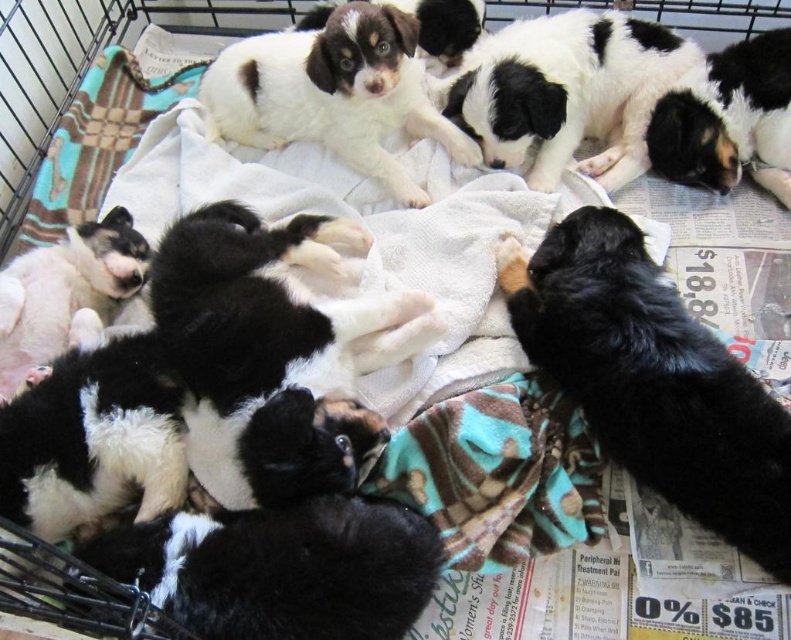
Question: Which of the following is the closest to the observer?

Choices:
 (A) (723, 454)
 (B) (55, 276)
 (C) (385, 80)
 (D) (313, 243)

Answer: (A)

Question: Does black soft fur at center appear under white fur at left?

Choices:
 (A) yes
 (B) no

Answer: (A)

Question: Among these points, which one is farthest from the camera?

Choices:
 (A) click(642, 445)
 (B) click(19, 305)
 (C) click(279, 38)

Answer: (C)

Question: Does black and white fur at upper center come behind white fur at left?

Choices:
 (A) no
 (B) yes

Answer: (B)

Question: Is black soft fur at center above white soft fur puppy at upper center?

Choices:
 (A) yes
 (B) no

Answer: (B)

Question: Which point is farther from the camera taking this photo?

Choices:
 (A) [x=31, y=305]
 (B) [x=214, y=211]

Answer: (B)